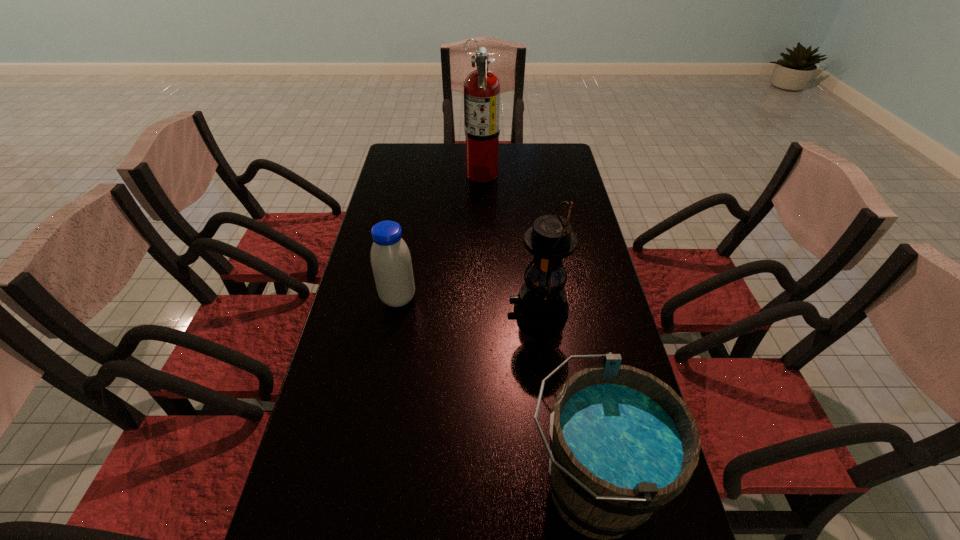
Where is a free space located above the third shortest object, indicating its light source? Please provide its 2D coordinates. Your answer should be formatted as a tuple, i.e. [(x, y)], where the tuple contains the x and y coordinates of a point satisfying the conditions above.

[(370, 309)]

I want to click on free location located on the right of the shortest object, so click(532, 298).

Identify the location of object that is at the far edge. Image resolution: width=960 pixels, height=540 pixels. (x=482, y=87).

Locate an element on the screen. object positioned at the left edge is located at coordinates (391, 263).

This screenshot has height=540, width=960. What are the coordinates of `object located at the right edge` in the screenshot? It's located at (541, 303).

Where is `vacant space at the far edge of the desktop`? The width and height of the screenshot is (960, 540). vacant space at the far edge of the desktop is located at coordinates (519, 171).

At what (x,y) coordinates should I click in order to perform the action: click on vacant space at the left edge. Please return your answer as a coordinate pair (x, y). Image resolution: width=960 pixels, height=540 pixels. Looking at the image, I should click on (355, 293).

In the image, there is a desktop. Where is `vacant space at the right edge`? Image resolution: width=960 pixels, height=540 pixels. vacant space at the right edge is located at coordinates (575, 282).

Where is `free space at the far left corner of the desktop`? free space at the far left corner of the desktop is located at coordinates [396, 145].

In the image, there is a desktop. What are the coordinates of `free space at the far right corner` in the screenshot? It's located at (548, 153).